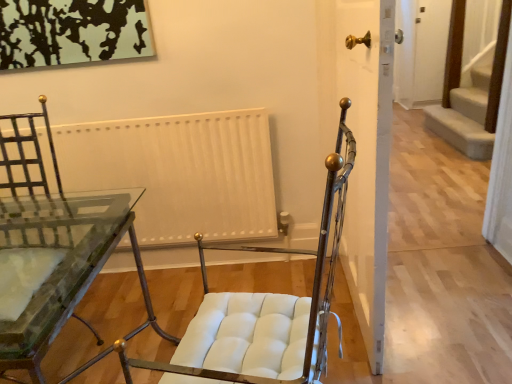
Question: Is white matte radiator at center aimed at clear glass table at center?

Choices:
 (A) yes
 (B) no

Answer: (A)

Question: Is white matte radiator at center smaller than clear glass table at center?

Choices:
 (A) yes
 (B) no

Answer: (A)

Question: Is the depth of white matte radiator at center less than that of clear glass table at center?

Choices:
 (A) yes
 (B) no

Answer: (B)

Question: Is white matte radiator at center completely or partially outside of clear glass table at center?

Choices:
 (A) yes
 (B) no

Answer: (A)

Question: From the image's perspective, would you say white matte radiator at center is positioned over clear glass table at center?

Choices:
 (A) no
 (B) yes

Answer: (B)

Question: Based on their sizes in the image, would you say clear glass table at center is bigger or smaller than white matte door at center?

Choices:
 (A) big
 (B) small

Answer: (A)

Question: From the image's perspective, is clear glass table at center located above or below white matte door at center?

Choices:
 (A) above
 (B) below

Answer: (B)

Question: In terms of width, does clear glass table at center look wider or thinner when compared to white matte door at center?

Choices:
 (A) thin
 (B) wide

Answer: (B)

Question: Does point (126, 226) appear closer or farther from the camera than point (354, 26)?

Choices:
 (A) closer
 (B) farther

Answer: (B)

Question: Is white matte radiator at center in front of or behind metallic/textured chair at center in the image?

Choices:
 (A) front
 (B) behind

Answer: (B)

Question: Considering the positions of white matte radiator at center and metallic/textured chair at center in the image, is white matte radiator at center taller or shorter than metallic/textured chair at center?

Choices:
 (A) tall
 (B) short

Answer: (B)

Question: Which is correct: white matte radiator at center is inside metallic/textured chair at center, or outside of it?

Choices:
 (A) outside
 (B) inside

Answer: (A)

Question: Based on their sizes in the image, would you say white matte radiator at center is bigger or smaller than metallic/textured chair at center?

Choices:
 (A) big
 (B) small

Answer: (B)

Question: Relative to metallic/textured chair at center, is white matte door at center in front or behind?

Choices:
 (A) behind
 (B) front

Answer: (A)

Question: From the image's perspective, is white matte door at center positioned above or below metallic/textured chair at center?

Choices:
 (A) below
 (B) above

Answer: (B)